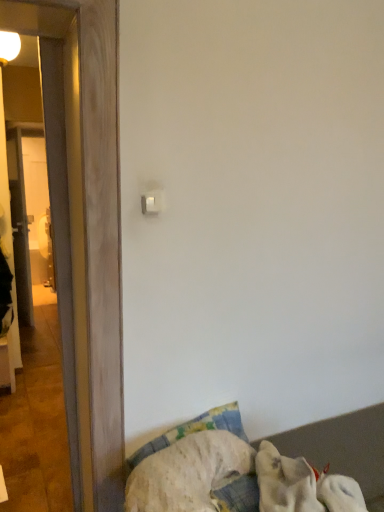
Question: Is white fabric at lower right in front of or behind wooden door at left in the image?

Choices:
 (A) behind
 (B) front

Answer: (B)

Question: From the image's perspective, is white fabric at lower right above or below wooden door at left?

Choices:
 (A) above
 (B) below

Answer: (B)

Question: Which of these objects is positioned closest to the white fabric at lower right?

Choices:
 (A) white plastic light switch at upper center
 (B) wooden door at left
 (C) white soft dog at lower right

Answer: (C)

Question: Estimate the real-world distances between objects in this image. Which object is farther from the white soft dog at lower right?

Choices:
 (A) white plastic light switch at upper center
 (B) wooden door at left
 (C) white fabric at lower right

Answer: (A)